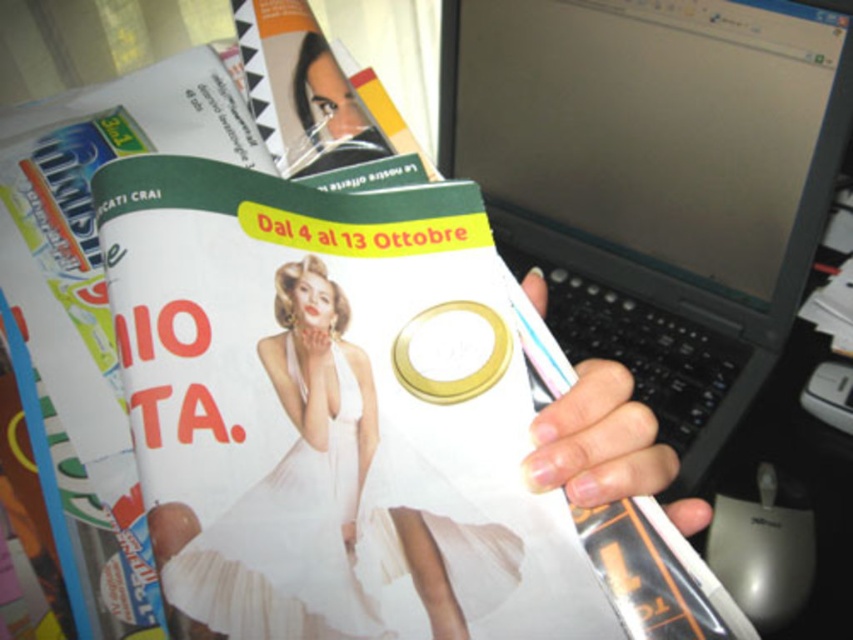
You are organizing a desk and need to place the black plastic laptop at upper right and the nail polish at center. According to the image, which object is positioned higher on the desk?

The black plastic laptop at upper right is located above the nail polish at center, so it is positioned higher on the desk.

You are trying to place a black plastic laptop at upper right on the desk. Where exactly should you place it?

You should place the black plastic laptop at upper right at point (656, 179).